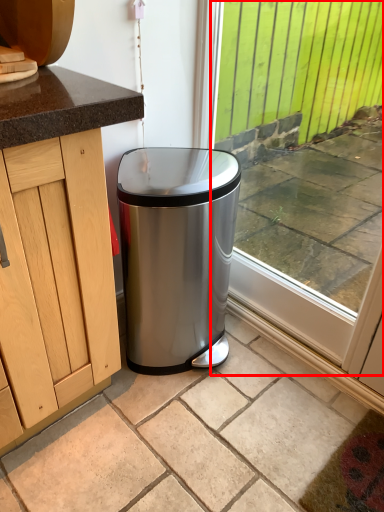
Question: Considering the relative positions of window (annotated by the red box) and granite in the image provided, where is window (annotated by the red box) located with respect to the staircase?

Choices:
 (A) left
 (B) right

Answer: (B)